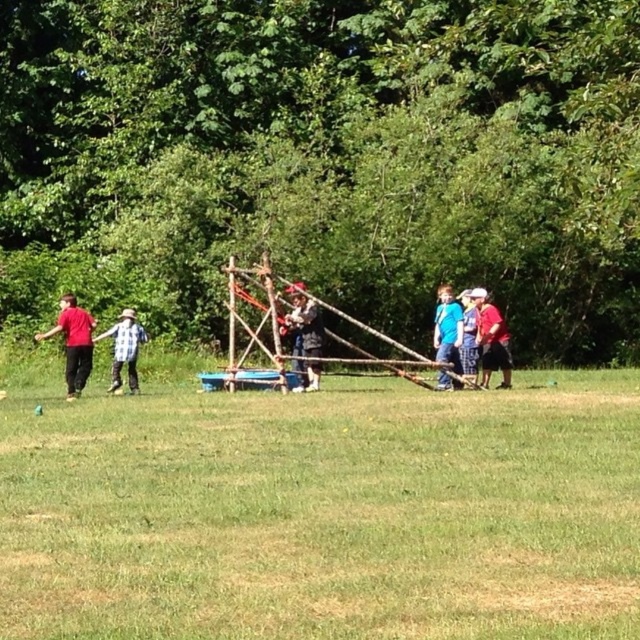
Is point (124, 333) in front of point (470, 317)?

No, (124, 333) is behind (470, 317).

How distant is plaid shirt at left from blue plaid shorts at center?

plaid shirt at left and blue plaid shorts at center are 5.33 meters apart.

Find the location of a particular element. plaid shirt at left is located at coordinates 124,348.

Does matte red shirt at left have a lesser width compared to wooden stick at center?

No.

Between point (68, 378) and point (291, 292), which one is positioned behind?

The point (291, 292) is more distant.

Where is `matte red shirt at left`? This screenshot has width=640, height=640. matte red shirt at left is located at coordinates (74, 342).

Does matte red shirt at center come behind wooden stick at center?

Yes, it is.

Can you confirm if matte red shirt at center is positioned below wooden stick at center?

Yes.

Image resolution: width=640 pixels, height=640 pixels. In order to click on matte red shirt at center in this screenshot , I will do `click(492, 339)`.

Where is `matte red shirt at center`? The height and width of the screenshot is (640, 640). matte red shirt at center is located at coordinates (492, 339).